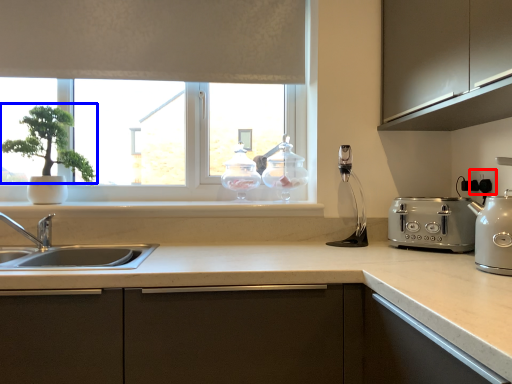
Question: Which of the following is the closest to the observer, electric outlet (highlighted by a red box) or plant (highlighted by a blue box)?

Choices:
 (A) electric outlet
 (B) plant

Answer: (A)